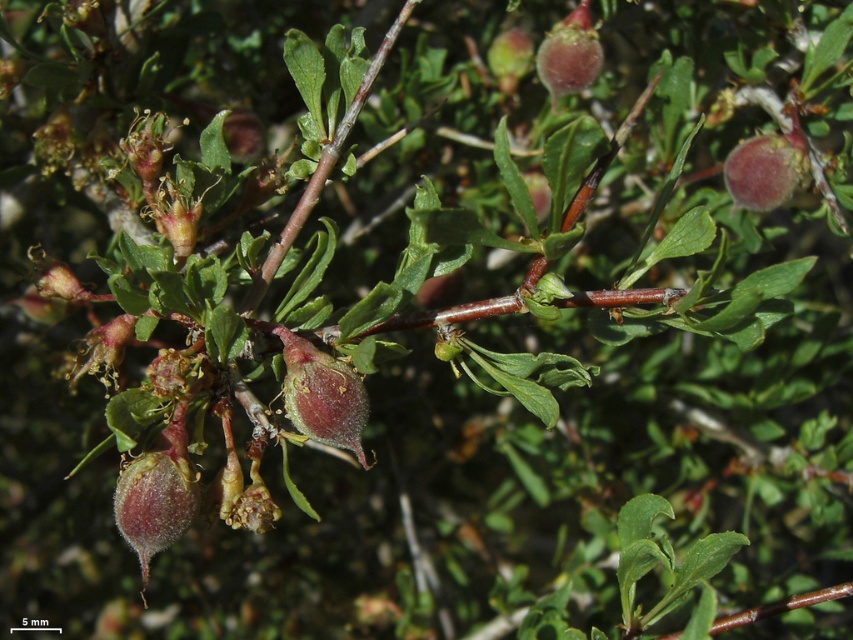
You are standing 5 feet away from the plant and want to observe a specific point on it. Is the point at coordinates point (x=315, y=404) within your viewing range?

The distance of point (x=315, y=404) from viewer is 4.51 feet, so yes, the point at coordinates point (x=315, y=404) is within your viewing range since it is closer than 5 feet.